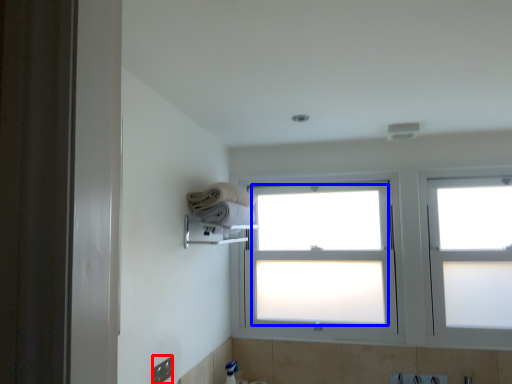
Question: Which object is further to the camera taking this photo, electric outlet (highlighted by a red box) or bay window (highlighted by a blue box)?

Choices:
 (A) electric outlet
 (B) bay window

Answer: (B)